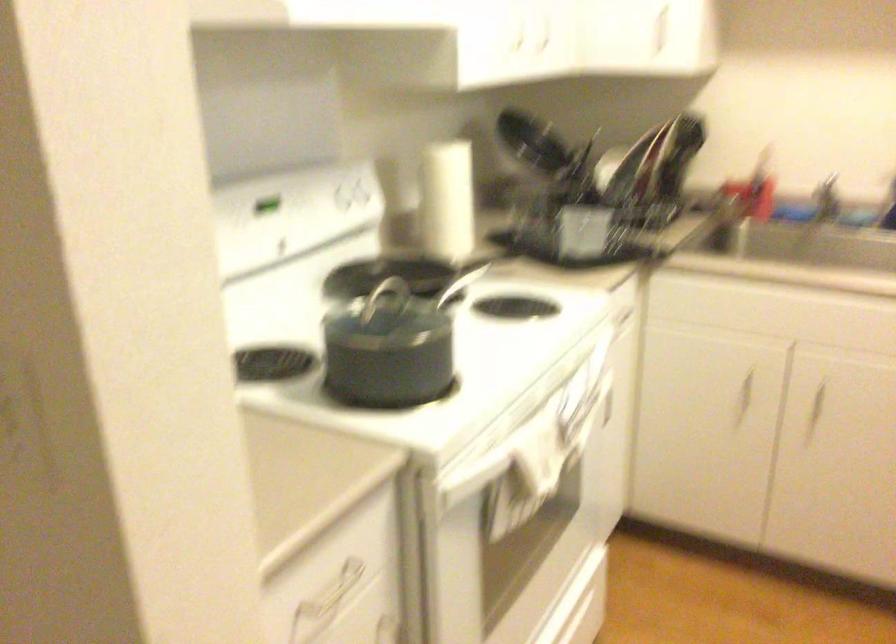
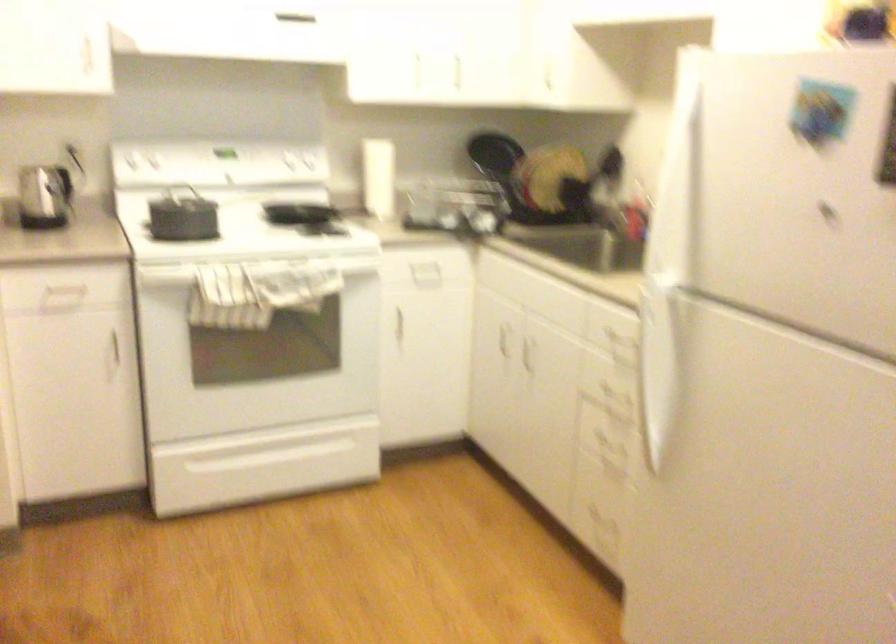
In the second image, find the point that corresponds to point 613,417 in the first image.

(425, 342)